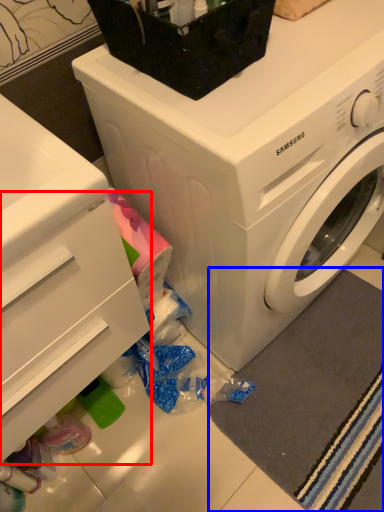
Question: Which point is closer to the camera, drawer (highlighted by a red box) or bath mat (highlighted by a blue box)?

Choices:
 (A) drawer
 (B) bath mat

Answer: (A)